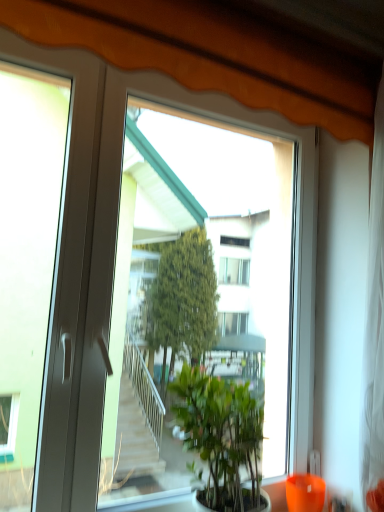
Question: Is green leafy plant at center located outside transparent glass window at center?

Choices:
 (A) yes
 (B) no

Answer: (A)

Question: From the image's perspective, is green leafy plant at center located above transparent glass window at center?

Choices:
 (A) no
 (B) yes

Answer: (A)

Question: Is green leafy plant at center oriented towards transparent glass window at center?

Choices:
 (A) yes
 (B) no

Answer: (B)

Question: Does green leafy plant at center have a larger size compared to transparent glass window at center?

Choices:
 (A) yes
 (B) no

Answer: (B)

Question: Is green leafy plant at center oriented away from transparent glass window at center?

Choices:
 (A) no
 (B) yes

Answer: (B)

Question: Would you say green leafy plant at center is inside or outside orange glass vase at lower right?

Choices:
 (A) inside
 (B) outside

Answer: (B)

Question: From their relative heights in the image, would you say green leafy plant at center is taller or shorter than orange glass vase at lower right?

Choices:
 (A) short
 (B) tall

Answer: (B)

Question: From a real-world perspective, relative to orange glass vase at lower right, is green leafy plant at center vertically above or below?

Choices:
 (A) above
 (B) below

Answer: (A)

Question: Relative to orange glass vase at lower right, is green leafy plant at center in front or behind?

Choices:
 (A) front
 (B) behind

Answer: (A)

Question: From a real-world perspective, relative to transparent glass window at center, is orange glass vase at lower right vertically above or below?

Choices:
 (A) below
 (B) above

Answer: (A)

Question: Choose the correct answer: Is orange glass vase at lower right inside transparent glass window at center or outside it?

Choices:
 (A) inside
 (B) outside

Answer: (B)

Question: Considering the positions of orange glass vase at lower right and transparent glass window at center in the image, is orange glass vase at lower right wider or thinner than transparent glass window at center?

Choices:
 (A) thin
 (B) wide

Answer: (B)

Question: From the image's perspective, relative to transparent glass window at center, is orange glass vase at lower right above or below?

Choices:
 (A) below
 (B) above

Answer: (A)

Question: Relative to green leafy plant at center, is transparent glass window at center in front or behind?

Choices:
 (A) behind
 (B) front

Answer: (B)

Question: Considering the positions of transparent glass window at center and green leafy plant at center in the image, is transparent glass window at center wider or thinner than green leafy plant at center?

Choices:
 (A) wide
 (B) thin

Answer: (B)